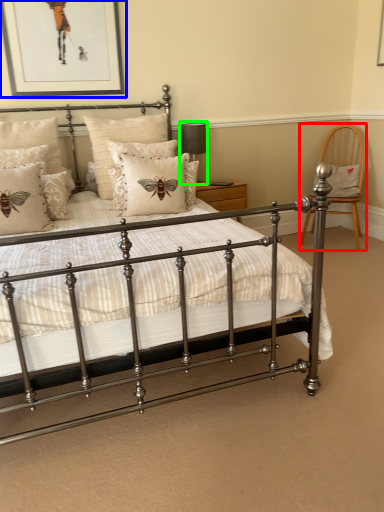
Question: Estimate the real-world distances between objects in this image. Which object is farther from chair (highlighted by a red box), picture frame (highlighted by a blue box) or table lamp (highlighted by a green box)?

Choices:
 (A) picture frame
 (B) table lamp

Answer: (A)